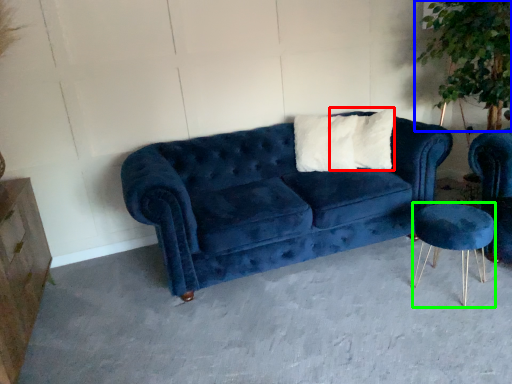
Question: Which object is the farthest from pillow (highlighted by a red box)? Choose among these: plant (highlighted by a blue box) or bar stool (highlighted by a green box).

Choices:
 (A) plant
 (B) bar stool

Answer: (B)